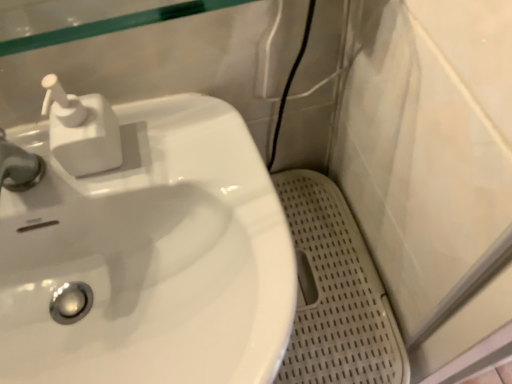
Question: Is point (104, 107) closer or farther from the camera than point (290, 223)?

Choices:
 (A) closer
 (B) farther

Answer: (A)

Question: In terms of width, does white plastic soap dispenser at upper left look wider or thinner when compared to white perforated mat at lower right?

Choices:
 (A) thin
 (B) wide

Answer: (A)

Question: Which is nearer to the white glossy sink at left?

Choices:
 (A) white perforated mat at lower right
 (B) white plastic soap dispenser at upper left

Answer: (B)

Question: Based on their relative distances, which object is nearer to the white plastic soap dispenser at upper left?

Choices:
 (A) white perforated mat at lower right
 (B) white glossy sink at left

Answer: (B)